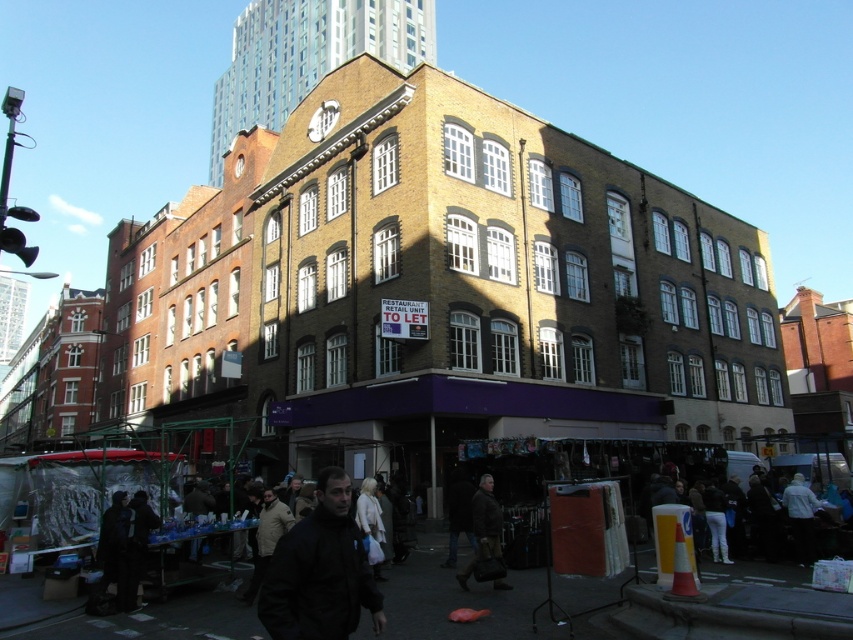
Which is above, brown leather jacket at center or white fabric coat at center?

brown leather jacket at center

Is point (498, 538) positioned in front of point (360, 496)?

Yes, it is in front of point (360, 496).

The height and width of the screenshot is (640, 853). What are the coordinates of `brown leather jacket at center` in the screenshot? It's located at (483, 528).

The image size is (853, 640). Find the location of `brown leather jacket at center`. brown leather jacket at center is located at coordinates (483, 528).

Is black matte jacket at lower center smaller than white fabric coat at center?

No, black matte jacket at lower center is not smaller than white fabric coat at center.

Which is behind, point (302, 534) or point (375, 516)?

Positioned behind is point (375, 516).

The image size is (853, 640). In order to click on black matte jacket at lower center in this screenshot , I will do `click(320, 572)`.

Between black matte jacket at lower center and brown leather jacket at center, which one has less height?

brown leather jacket at center

Is point (283, 636) positioned behind point (492, 492)?

No, it is in front of (492, 492).

I want to click on black matte jacket at lower center, so click(x=320, y=572).

Where is `black matte jacket at lower center`? This screenshot has height=640, width=853. black matte jacket at lower center is located at coordinates (320, 572).